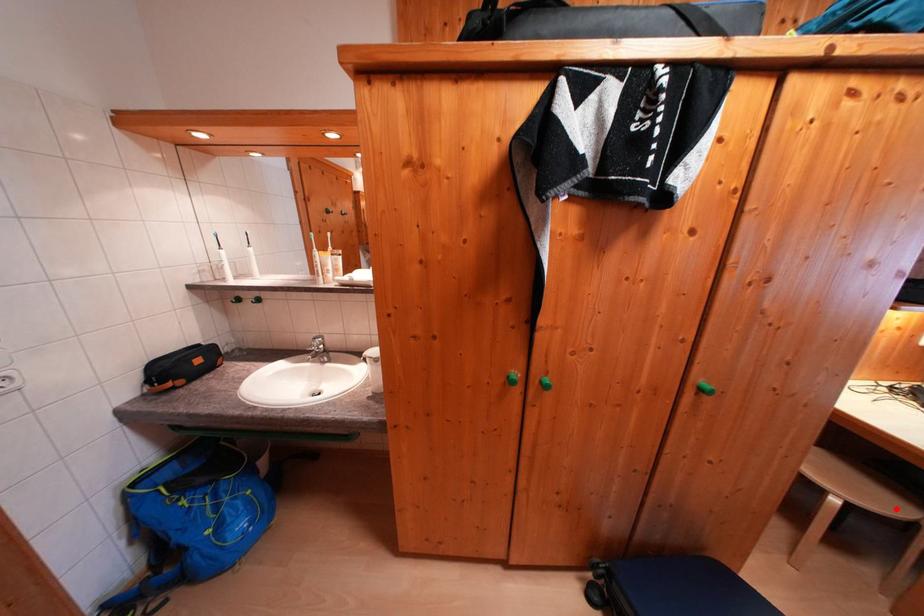
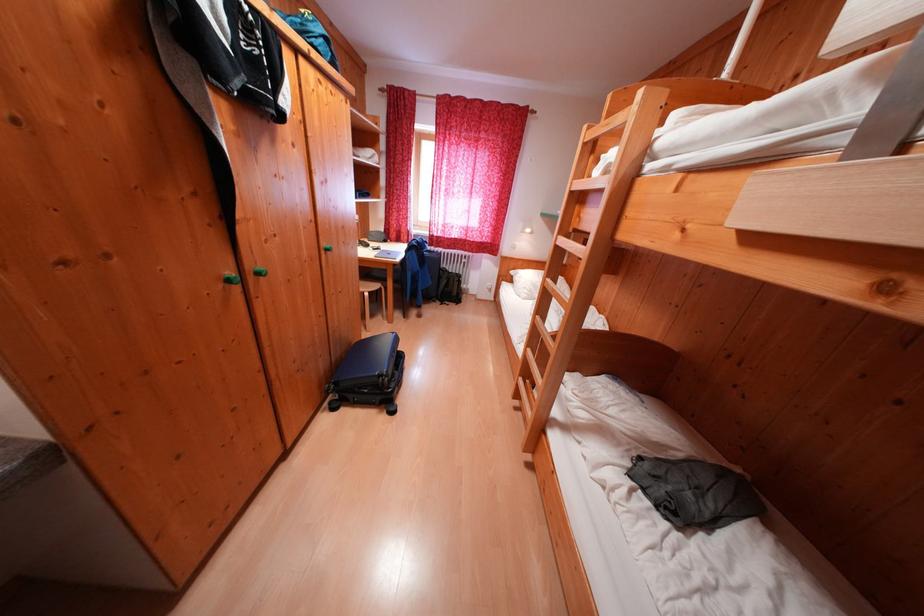
Question: I am providing you with two images of the same scene from different viewpoints. In image1, a red point is highlighted. Considering the same 3D point in image2, which of the following is correct?

Choices:
 (A) It is closer
 (B) It is farther

Answer: (A)